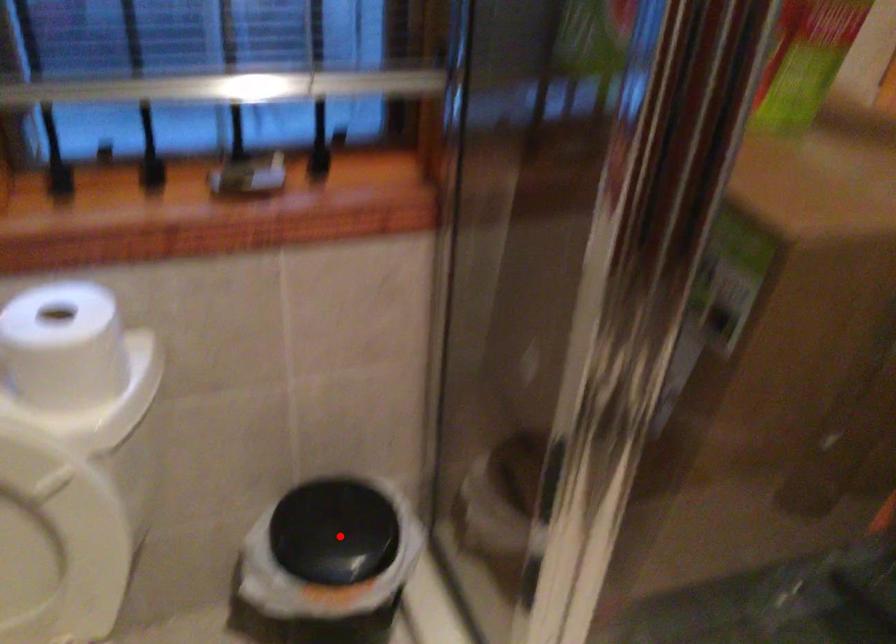
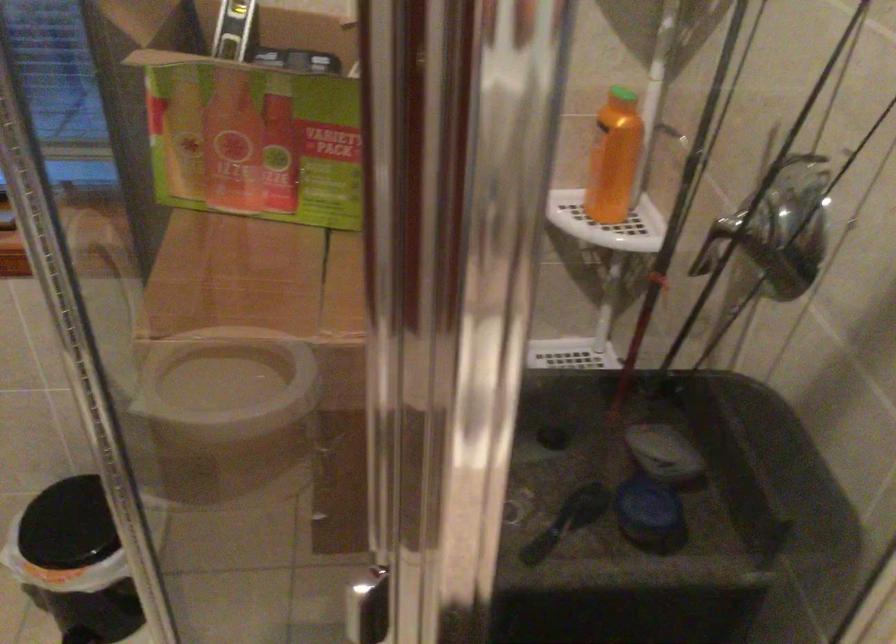
In the second image, find the point that corresponds to the highlighted location in the first image.

(67, 525)